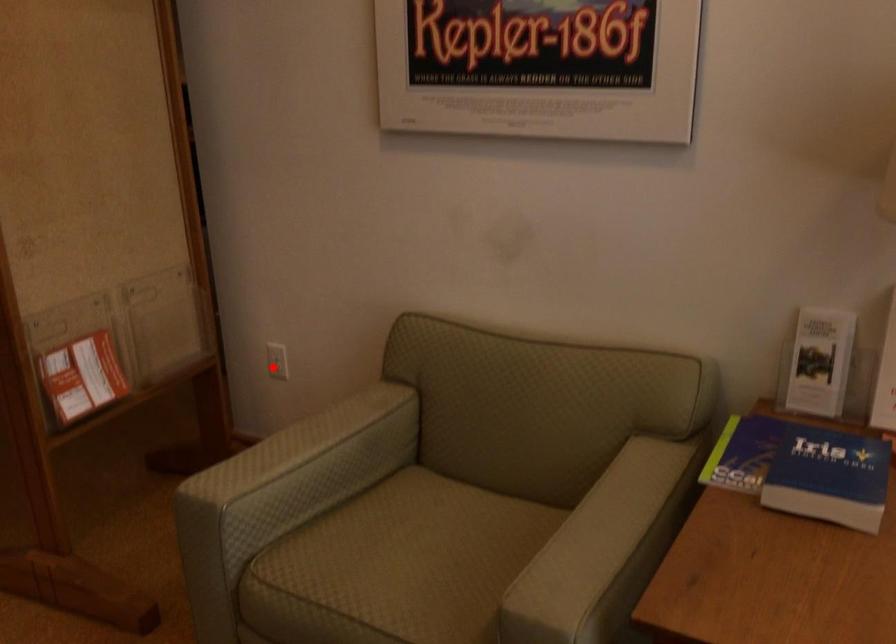
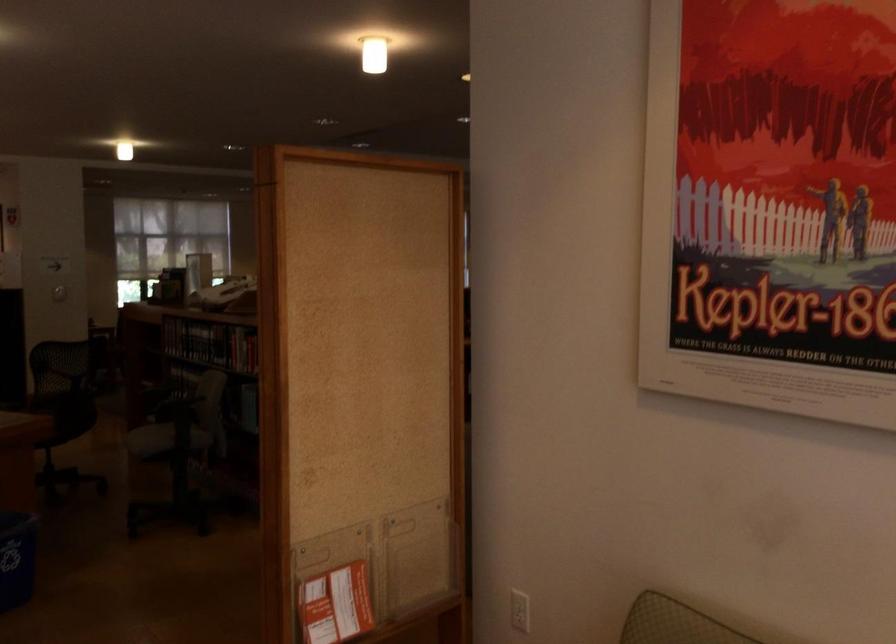
In the second image, find the point that corresponds to the highlighted location in the first image.

(520, 610)